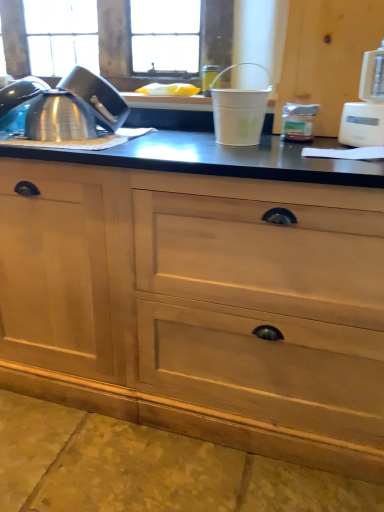
Question: From a real-world perspective, is natural wood cabinet at center, placed as the first cabinetry when sorted from left to right, on top of white plastic bucket at center, which is the 2th appliance from right to left?

Choices:
 (A) no
 (B) yes

Answer: (A)

Question: Is natural wood cabinet at center, the second cabinetry positioned from the right, oriented away from white plastic bucket at center, the 1th appliance when ordered from left to right?

Choices:
 (A) no
 (B) yes

Answer: (A)

Question: Would you say natural wood cabinet at center, the second cabinetry positioned from the right, is outside white plastic bucket at center, which is the 2th appliance from right to left?

Choices:
 (A) yes
 (B) no

Answer: (A)

Question: From a real-world perspective, is natural wood cabinet at center, the second cabinetry positioned from the right, beneath white plastic bucket at center, which is the 2th appliance from right to left?

Choices:
 (A) no
 (B) yes

Answer: (B)

Question: Is natural wood cabinet at center, placed as the first cabinetry when sorted from left to right, to the right of white plastic bucket at center, which is the 2th appliance from right to left, from the viewer's perspective?

Choices:
 (A) yes
 (B) no

Answer: (B)

Question: Could white plastic bucket at center, the 1th appliance when ordered from left to right, be considered to be inside natural wood cabinet at center, placed as the first cabinetry when sorted from left to right?

Choices:
 (A) no
 (B) yes

Answer: (A)

Question: Is white plastic bucket at center, which is the 2th appliance from right to left, at the left side of satin metallic teapot at left?

Choices:
 (A) yes
 (B) no

Answer: (B)

Question: Can you confirm if white plastic bucket at center, the 1th appliance when ordered from left to right, is smaller than satin metallic teapot at left?

Choices:
 (A) no
 (B) yes

Answer: (B)

Question: Is the position of white plastic bucket at center, which is the 2th appliance from right to left, more distant than that of satin metallic teapot at left?

Choices:
 (A) yes
 (B) no

Answer: (B)

Question: Considering the relative sizes of white plastic bucket at center, which is the 2th appliance from right to left, and satin metallic teapot at left in the image provided, is white plastic bucket at center, which is the 2th appliance from right to left, bigger than satin metallic teapot at left?

Choices:
 (A) no
 (B) yes

Answer: (A)

Question: Is white plastic bucket at center, which is the 2th appliance from right to left, positioned in front of satin metallic teapot at left?

Choices:
 (A) yes
 (B) no

Answer: (A)

Question: Does white plastic bucket at center, which is the 2th appliance from right to left, turn towards satin metallic teapot at left?

Choices:
 (A) yes
 (B) no

Answer: (B)

Question: Can you confirm if white plastic blender at right, placed as the 2th appliance when sorted from left to right, is smaller than satin metallic teapot at left?

Choices:
 (A) no
 (B) yes

Answer: (A)